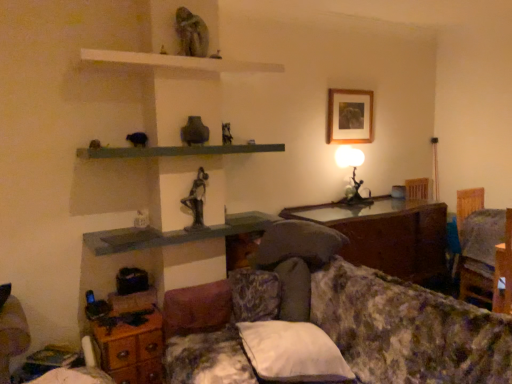
Question: Does bronze statue at center have a lesser width compared to matte gray shelf at center, positioned as the 1th shelf in bottom-to-top order?

Choices:
 (A) yes
 (B) no

Answer: (A)

Question: Is bronze statue at center turned away from matte gray shelf at center, the 3th shelf from the top?

Choices:
 (A) no
 (B) yes

Answer: (A)

Question: Considering the relative positions of bronze statue at center and matte gray shelf at center, the 3th shelf from the top, in the image provided, is bronze statue at center in front of matte gray shelf at center, the 3th shelf from the top,?

Choices:
 (A) no
 (B) yes

Answer: (A)

Question: Considering the relative positions of bronze statue at center and matte gray shelf at center, positioned as the 1th shelf in bottom-to-top order, in the image provided, is bronze statue at center behind matte gray shelf at center, positioned as the 1th shelf in bottom-to-top order,?

Choices:
 (A) no
 (B) yes

Answer: (B)

Question: Considering the relative positions of bronze statue at center and matte gray shelf at center, the 3th shelf from the top, in the image provided, is bronze statue at center to the right of matte gray shelf at center, the 3th shelf from the top, from the viewer's perspective?

Choices:
 (A) no
 (B) yes

Answer: (B)

Question: From their relative heights in the image, would you say green matte shelf at center, acting as the second shelf starting from the bottom, is taller or shorter than white soft pillow at lower center?

Choices:
 (A) tall
 (B) short

Answer: (B)

Question: Considering their positions, is green matte shelf at center, acting as the second shelf starting from the bottom, located in front of or behind white soft pillow at lower center?

Choices:
 (A) front
 (B) behind

Answer: (B)

Question: From a real-world perspective, is green matte shelf at center, placed as the second shelf when sorted from top to bottom, physically located above or below white soft pillow at lower center?

Choices:
 (A) above
 (B) below

Answer: (A)

Question: Would you say green matte shelf at center, acting as the second shelf starting from the bottom, is to the left or to the right of white soft pillow at lower center in the picture?

Choices:
 (A) left
 (B) right

Answer: (A)

Question: Considering the positions of matte gray shelf at center, the 3th shelf from the top, and green matte shelf at center, placed as the second shelf when sorted from top to bottom, in the image, is matte gray shelf at center, the 3th shelf from the top, taller or shorter than green matte shelf at center, placed as the second shelf when sorted from top to bottom,?

Choices:
 (A) short
 (B) tall

Answer: (A)

Question: Is matte gray shelf at center, the 3th shelf from the top, to the left or to the right of green matte shelf at center, acting as the second shelf starting from the bottom, in the image?

Choices:
 (A) left
 (B) right

Answer: (B)

Question: Considering the positions of matte gray shelf at center, positioned as the 1th shelf in bottom-to-top order, and green matte shelf at center, placed as the second shelf when sorted from top to bottom, in the image, is matte gray shelf at center, positioned as the 1th shelf in bottom-to-top order, wider or thinner than green matte shelf at center, placed as the second shelf when sorted from top to bottom,?

Choices:
 (A) wide
 (B) thin

Answer: (A)

Question: From a real-world perspective, relative to green matte shelf at center, acting as the second shelf starting from the bottom, is matte gray shelf at center, the 3th shelf from the top, vertically above or below?

Choices:
 (A) above
 (B) below

Answer: (B)

Question: From the image's perspective, is green matte shelf at center, acting as the second shelf starting from the bottom, located above or below wooden dresser at lower left?

Choices:
 (A) above
 (B) below

Answer: (A)

Question: Looking at their shapes, would you say green matte shelf at center, placed as the second shelf when sorted from top to bottom, is wider or thinner than wooden dresser at lower left?

Choices:
 (A) thin
 (B) wide

Answer: (B)